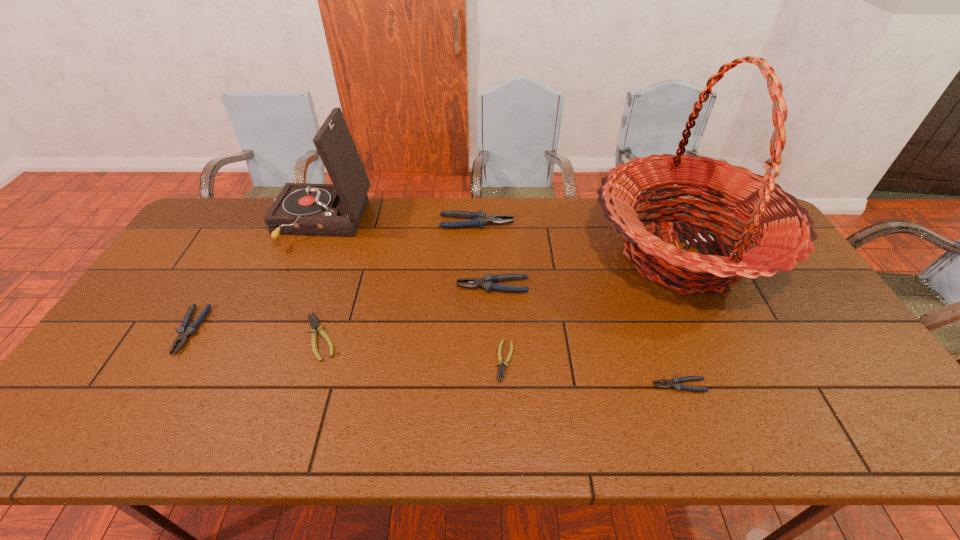
I want to click on free space located at the gripping part of the fourth shortest object, so click(143, 410).

Find the location of a particular element. This screenshot has height=540, width=960. free location located 0.130m at the gripping part of the fourth tallest pliers is located at coordinates (599, 386).

You are a GUI agent. You are given a task and a screenshot of the screen. Output one action in this format:
    pyautogui.click(x=<x>, y=<y>)
    Task: Click on the blank space located at the gripping part of the fourth tallest pliers
    Image resolution: width=960 pixels, height=540 pixels.
    Given the screenshot: What is the action you would take?
    pyautogui.click(x=544, y=386)

You are a GUI agent. You are given a task and a screenshot of the screen. Output one action in this format:
    pyautogui.click(x=<x>, y=<y>)
    Task: Click on the free space located at the gripping part of the fourth tallest pliers
    
    Given the screenshot: What is the action you would take?
    pyautogui.click(x=594, y=386)

Where is `free space located on the right of the second pliers from left to right`? free space located on the right of the second pliers from left to right is located at coordinates (491, 337).

Locate an element on the screen. The height and width of the screenshot is (540, 960). free space located 0.070m on the left of the shortest pliers is located at coordinates (468, 361).

This screenshot has width=960, height=540. What are the coordinates of `basket that is at the far edge` in the screenshot? It's located at (783, 235).

Locate an element on the screen. phonograph record that is at the far edge is located at coordinates (309, 209).

Locate an element on the screen. This screenshot has width=960, height=540. pliers that is at the far edge is located at coordinates (479, 219).

Image resolution: width=960 pixels, height=540 pixels. I want to click on object situated at the left edge, so [184, 331].